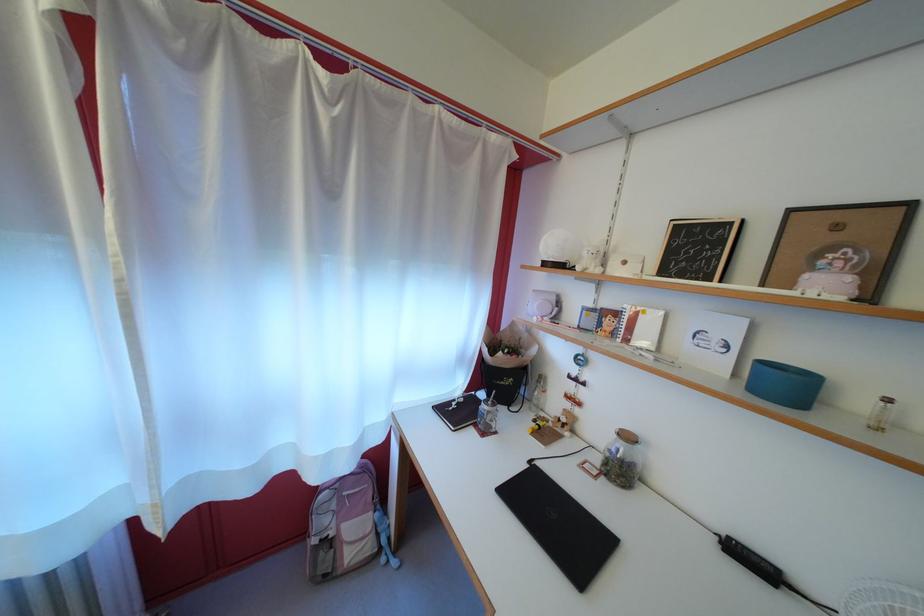
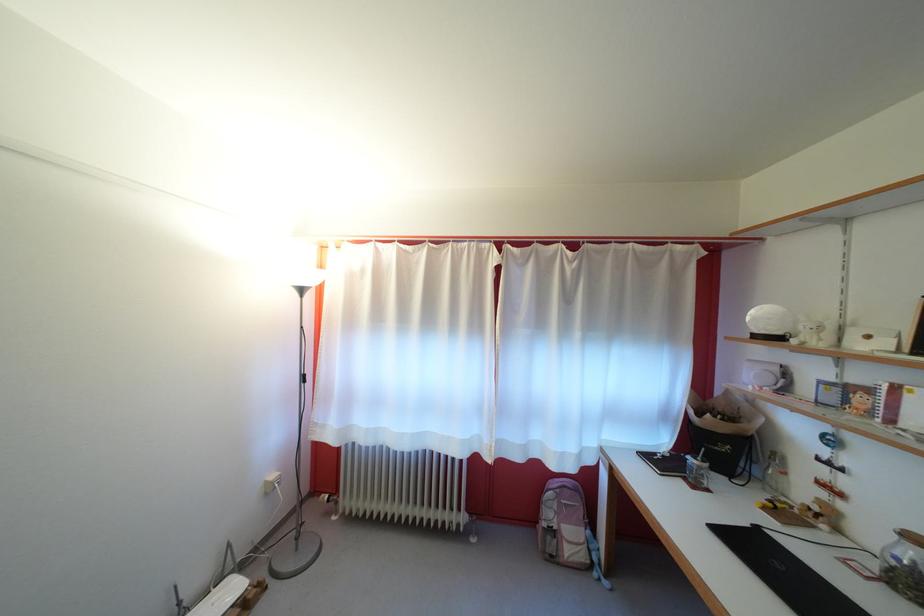
In the second image, find the point that corresponds to point (497, 418) in the first image.

(708, 474)